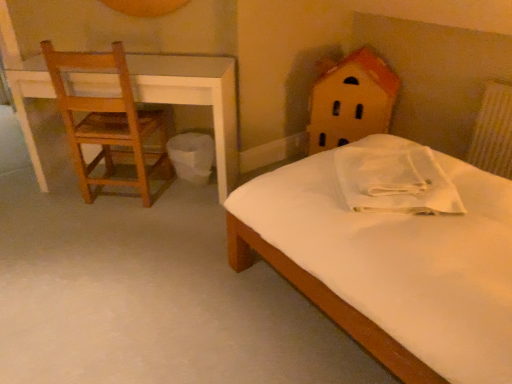
Question: Is the depth of wooden house at upper right less than that of white textured radiator at right?

Choices:
 (A) yes
 (B) no

Answer: (B)

Question: Is wooden house at upper right oriented towards white textured radiator at right?

Choices:
 (A) no
 (B) yes

Answer: (A)

Question: From a real-world perspective, is wooden house at upper right located beneath white textured radiator at right?

Choices:
 (A) yes
 (B) no

Answer: (A)

Question: From the image's perspective, would you say wooden house at upper right is shown under white textured radiator at right?

Choices:
 (A) no
 (B) yes

Answer: (A)

Question: Can white textured radiator at right be found inside wooden house at upper right?

Choices:
 (A) no
 (B) yes

Answer: (A)

Question: From their relative heights in the image, would you say wooden house at upper right is taller or shorter than white plastic trash bin at lower center?

Choices:
 (A) tall
 (B) short

Answer: (A)

Question: Looking at the image, does wooden house at upper right seem bigger or smaller compared to white plastic trash bin at lower center?

Choices:
 (A) small
 (B) big

Answer: (B)

Question: Is wooden house at upper right to the left or to the right of white plastic trash bin at lower center in the image?

Choices:
 (A) left
 (B) right

Answer: (B)

Question: Considering the positions of point (326, 114) and point (201, 158), is point (326, 114) closer or farther from the camera than point (201, 158)?

Choices:
 (A) closer
 (B) farther

Answer: (B)

Question: Considering the positions of white plastic trash bin at lower center and white textured radiator at right in the image, is white plastic trash bin at lower center taller or shorter than white textured radiator at right?

Choices:
 (A) short
 (B) tall

Answer: (A)

Question: Is white plastic trash bin at lower center wider or thinner than white textured radiator at right?

Choices:
 (A) thin
 (B) wide

Answer: (B)

Question: Would you say white plastic trash bin at lower center is inside or outside white textured radiator at right?

Choices:
 (A) inside
 (B) outside

Answer: (B)

Question: Based on their sizes in the image, would you say white plastic trash bin at lower center is bigger or smaller than white textured radiator at right?

Choices:
 (A) small
 (B) big

Answer: (B)

Question: From the image's perspective, is wooden house at upper right above or below white textured radiator at right?

Choices:
 (A) below
 (B) above

Answer: (B)

Question: Choose the correct answer: Is wooden house at upper right inside white textured radiator at right or outside it?

Choices:
 (A) inside
 (B) outside

Answer: (B)